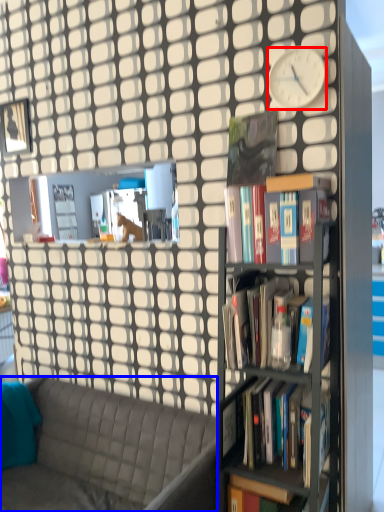
Question: Which object appears closest to the camera in this image, clock (highlighted by a red box) or studio couch (highlighted by a blue box)?

Choices:
 (A) clock
 (B) studio couch

Answer: (B)